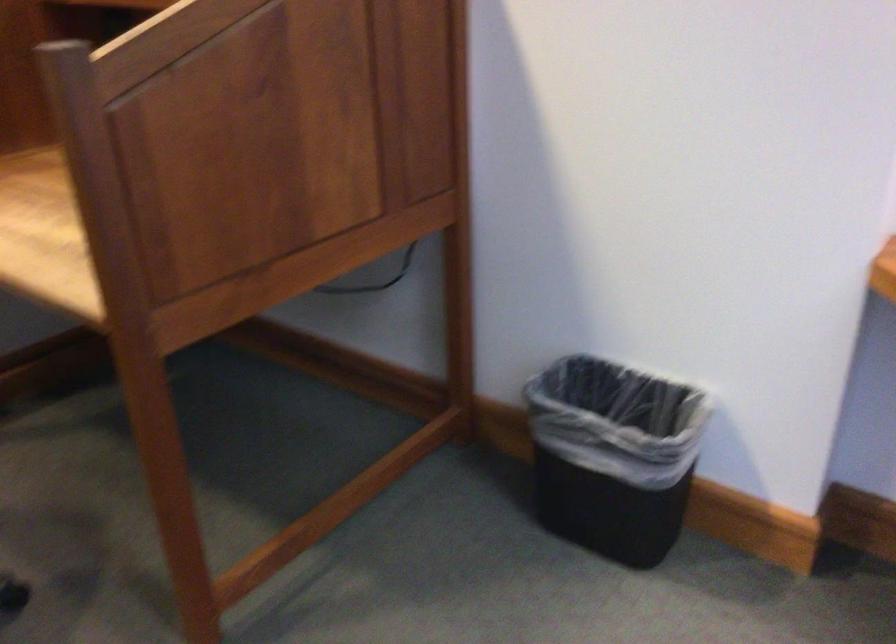
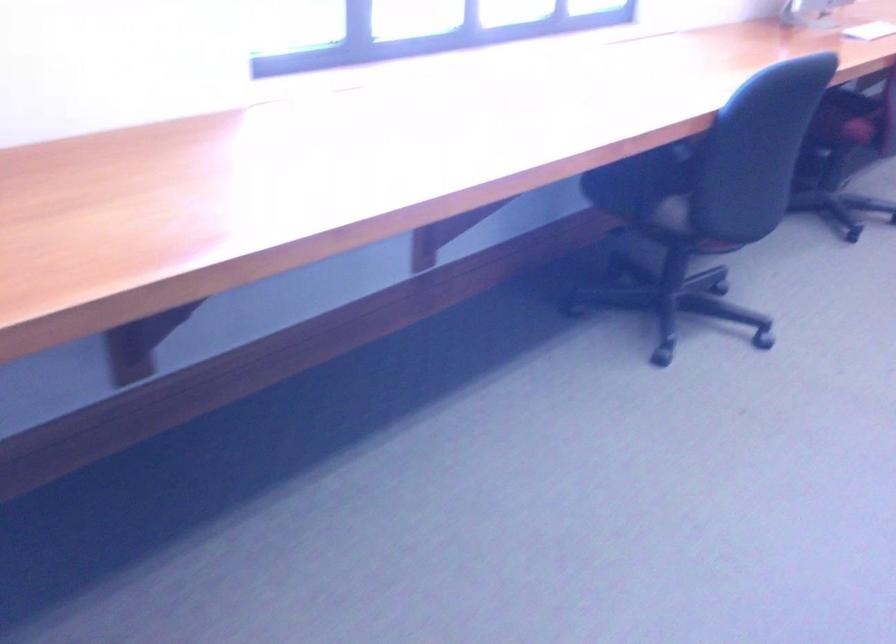
The first image is from the beginning of the video and the second image is from the end. How did the camera likely rotate when shooting the video?

The camera rotated toward right-down.